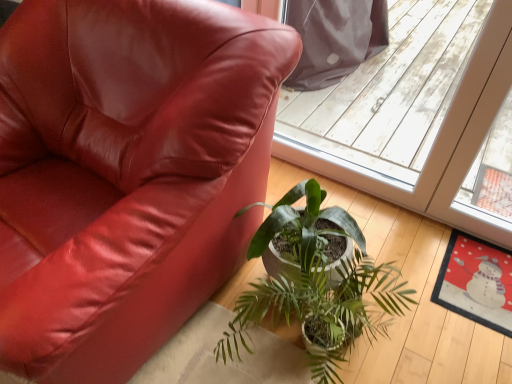
Question: From a real-world perspective, is green glossy plant at center positioned above or below matte leather chair at lower left?

Choices:
 (A) below
 (B) above

Answer: (A)

Question: Relative to matte leather chair at lower left, is green glossy plant at center in front or behind?

Choices:
 (A) behind
 (B) front

Answer: (A)

Question: Which object is the farthest from the matte leather chair at lower left?

Choices:
 (A) green glossy plant at center
 (B) transparent plastic screen door at upper center

Answer: (B)

Question: Estimate the real-world distances between objects in this image. Which object is farther from the green glossy plant at center?

Choices:
 (A) transparent plastic screen door at upper center
 (B) matte leather chair at lower left

Answer: (A)